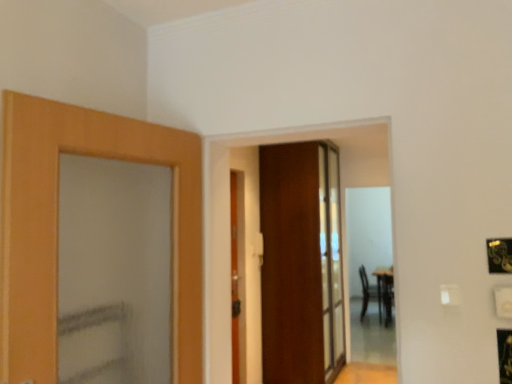
You are a GUI agent. You are given a task and a screenshot of the screen. Output one action in this format:
    pyautogui.click(x=<x>, y=<y>)
    Task: Click on the wooden door at center, acting as the 2th door starting from the right
    This screenshot has width=512, height=384.
    Given the screenshot: What is the action you would take?
    pyautogui.click(x=234, y=279)

Image resolution: width=512 pixels, height=384 pixels. In order to click on wooden door at center, which ranks as the first door in back-to-front order in this screenshot , I will do `click(301, 263)`.

Find the location of a particular element. This screenshot has height=384, width=512. black leather armchair at right is located at coordinates (370, 292).

Would you say wooden door at center, acting as the 2th door starting from the right, is inside or outside black leather armchair at right?

wooden door at center, acting as the 2th door starting from the right, exists outside the volume of black leather armchair at right.

Is black leather armchair at right at the back of wooden door at center, which ranks as the first door in left-to-right order?

No, black leather armchair at right is not at the back of wooden door at center, which ranks as the first door in left-to-right order.

From the image's perspective, which object appears higher, wooden door at center, acting as the 1th door starting from the front, or black leather armchair at right?

wooden door at center, acting as the 1th door starting from the front, from the image's perspective.

Is black leather armchair at right not inside wooden door at center, the 1th door when ordered from right to left?

black leather armchair at right is positioned outside wooden door at center, the 1th door when ordered from right to left.

Considering the relative sizes of black leather armchair at right and wooden door at center, the 1th door when ordered from right to left, in the image provided, is black leather armchair at right thinner than wooden door at center, the 1th door when ordered from right to left,?

Indeed, black leather armchair at right has a lesser width compared to wooden door at center, the 1th door when ordered from right to left.

Consider the image. How many degrees apart are the facing directions of black leather armchair at right and wooden door at center, the 1th door when ordered from right to left?

1.7 degrees separate the facing orientations of black leather armchair at right and wooden door at center, the 1th door when ordered from right to left.

In order to click on armchair below the wooden door at center, which ranks as the first door in back-to-front order (from the image's perspective) in this screenshot , I will do `click(370, 292)`.

Who is shorter, wooden door at center, the 1th door when ordered from right to left, or wooden door at center, which ranks as the first door in left-to-right order?

With less height is wooden door at center, which ranks as the first door in left-to-right order.

From the image's perspective, which is below, wooden door at center, the 2th door from the left, or wooden door at center, placed as the 2th door when sorted from back to front?

wooden door at center, placed as the 2th door when sorted from back to front, is shown below in the image.

Which is less distant, (289, 362) or (237, 309)?

Positioned in front is point (237, 309).

From a real-world perspective, is wooden door at center, acting as the 2th door starting from the front, positioned above or below black leather armchair at right?

Clearly, from a real-world perspective, wooden door at center, acting as the 2th door starting from the front, is above black leather armchair at right.

Based on the photo, from the image's perspective, does wooden door at center, the 1th door when ordered from right to left, appear lower than black leather armchair at right?

No.

Is wooden door at center, acting as the 2th door starting from the front, turned away from black leather armchair at right?

No, black leather armchair at right is not at the back of wooden door at center, acting as the 2th door starting from the front.

Does point (289, 163) come farther from viewer compared to point (377, 294)?

That is False.

Is wooden door at center, acting as the 2th door starting from the front, surrounded by wooden door at center, placed as the 2th door when sorted from back to front?

Definitely not — wooden door at center, acting as the 2th door starting from the front, is not inside wooden door at center, placed as the 2th door when sorted from back to front.

From the image's perspective, would you say wooden door at center, acting as the 1th door starting from the front, is shown under wooden door at center, which ranks as the first door in back-to-front order?

Indeed, from the image's perspective, wooden door at center, acting as the 1th door starting from the front, is shown beneath wooden door at center, which ranks as the first door in back-to-front order.

Is point (236, 191) positioned before point (277, 297)?

That is True.

Who is shorter, wooden door at center, which ranks as the first door in left-to-right order, or wooden door at center, the 1th door when ordered from right to left?

With less height is wooden door at center, which ranks as the first door in left-to-right order.

Does black leather armchair at right have a greater width compared to wooden door at center, placed as the 2th door when sorted from back to front?

Yes.

Does black leather armchair at right touch wooden door at center, which ranks as the first door in left-to-right order?

black leather armchair at right is not next to wooden door at center, which ranks as the first door in left-to-right order, and they're not touching.

Measure the distance from black leather armchair at right to wooden door at center, placed as the 2th door when sorted from back to front.

black leather armchair at right and wooden door at center, placed as the 2th door when sorted from back to front, are 4.15 meters apart.

In order to click on armchair beneath the wooden door at center, acting as the 1th door starting from the front (from a real-world perspective) in this screenshot , I will do `click(370, 292)`.

In order to click on armchair on the right of wooden door at center, which ranks as the first door in left-to-right order in this screenshot , I will do `click(370, 292)`.

At what (x,y) coordinates should I click in order to perform the action: click on the 1st door in front of the black leather armchair at right. Please return your answer as a coordinate pair (x, y). The image size is (512, 384). Looking at the image, I should click on (301, 263).

From the image, which object appears to be farther from wooden door at center, placed as the 2th door when sorted from back to front, wooden door at center, the 2th door from the left, or black leather armchair at right?

black leather armchair at right lies further to wooden door at center, placed as the 2th door when sorted from back to front, than the other object.

Looking at the image, which one is located further to wooden door at center, which ranks as the first door in back-to-front order, wooden door at center, acting as the 2th door starting from the right, or black leather armchair at right?

black leather armchair at right lies further to wooden door at center, which ranks as the first door in back-to-front order, than the other object.

Looking at this image, looking at the image, which one is located further to wooden door at center, the 1th door when ordered from right to left, black leather armchair at right or wooden door at center, acting as the 2th door starting from the right?

black leather armchair at right.

Which object lies further to the anchor point black leather armchair at right, wooden door at center, placed as the 2th door when sorted from back to front, or wooden door at center, which ranks as the first door in back-to-front order?

The object further to black leather armchair at right is wooden door at center, placed as the 2th door when sorted from back to front.

Looking at the image, which one is located further to black leather armchair at right, wooden door at center, which ranks as the first door in back-to-front order, or wooden door at center, which ranks as the first door in left-to-right order?

wooden door at center, which ranks as the first door in left-to-right order, is further to black leather armchair at right.

Looking at the image, which one is located further to wooden door at center, placed as the 2th door when sorted from back to front, black leather armchair at right or wooden door at center, acting as the 2th door starting from the front?

black leather armchair at right lies further to wooden door at center, placed as the 2th door when sorted from back to front, than the other object.

You are a GUI agent. You are given a task and a screenshot of the screen. Output one action in this format:
    pyautogui.click(x=<x>, y=<y>)
    Task: Click on the door between wooden door at center, acting as the 2th door starting from the right, and black leather armchair at right, along the z-axis
    This screenshot has width=512, height=384.
    Given the screenshot: What is the action you would take?
    pyautogui.click(x=301, y=263)